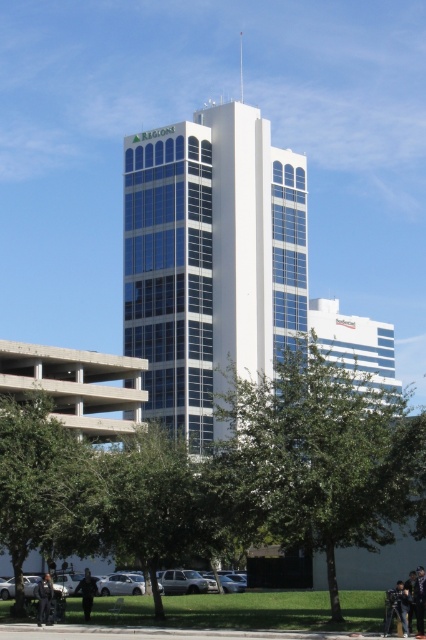
Is green leafy tree at lower center further to camera compared to black leather jacket at lower left?

No, green leafy tree at lower center is closer to the viewer.

Who is positioned more to the right, green leafy tree at lower center or black leather jacket at lower left?

green leafy tree at lower center

Where is `green leafy tree at lower center`? green leafy tree at lower center is located at coordinates (155, 502).

Where is `green leafy tree at lower center`? green leafy tree at lower center is located at coordinates (155, 502).

Can you confirm if dark gray jacket at lower left is bigger than black leather jacket at lower center?

Yes.

Is dark gray jacket at lower left below black leather jacket at lower center?

Correct, dark gray jacket at lower left is located below black leather jacket at lower center.

Who is more forward, (x=81, y=595) or (x=405, y=586)?

Point (x=405, y=586) is in front.

Identify the location of dark gray jacket at lower left. The image size is (426, 640). (86, 593).

The width and height of the screenshot is (426, 640). What do you see at coordinates (322, 458) in the screenshot? I see `green leafy tree at center` at bounding box center [322, 458].

Between green leafy tree at center and dark blue jeans at lower center, which one has less height?

With less height is dark blue jeans at lower center.

Who is more distant from viewer, (345, 417) or (422, 627)?

Positioned behind is point (345, 417).

Find the location of a particular element. green leafy tree at center is located at coordinates (322, 458).